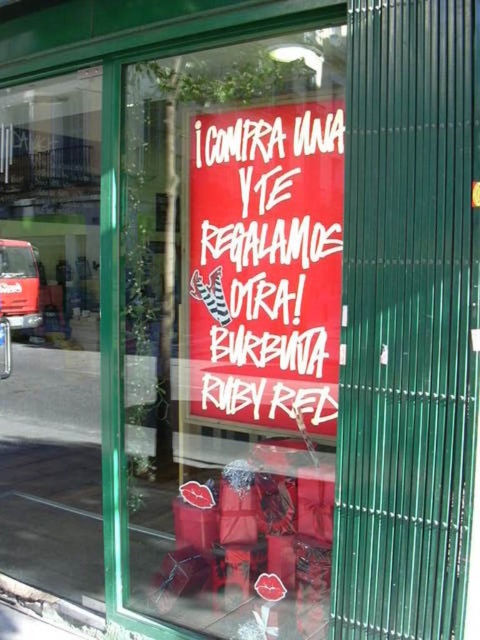
You are a customer standing outside the store looking through the transparent glass window at left. You want to read the promotional text on the red paper sign at center. Is the sign visible through the window?

The red paper sign at center is located below the transparent glass window at left, so it is positioned behind the window. Since the window is transparent, you should be able to see the sign through it while standing outside.

You are a customer standing outside the store looking through the transparent glass window at left. Can you see the red paper sign at center clearly?

The red paper sign at center is in front of the transparent glass window at left, so it is blocking the view of the sign from outside. Therefore, you cannot see the red paper sign at center clearly through the transparent glass window at left.

You are a customer standing outside the store looking at the storefront window. There is a transparent glass window at left located at point (51, 337). Can you see the red sign inside the store through the transparent glass window at left?

The transparent glass window at left is located at point (51, 337), so yes, you can see the red sign inside the store through the transparent glass window at left because it is made of transparent material.